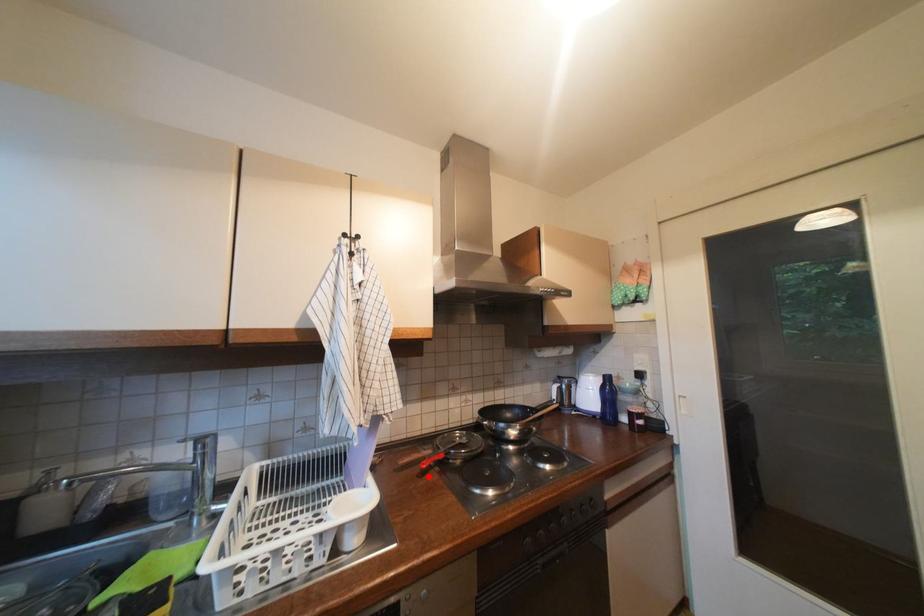
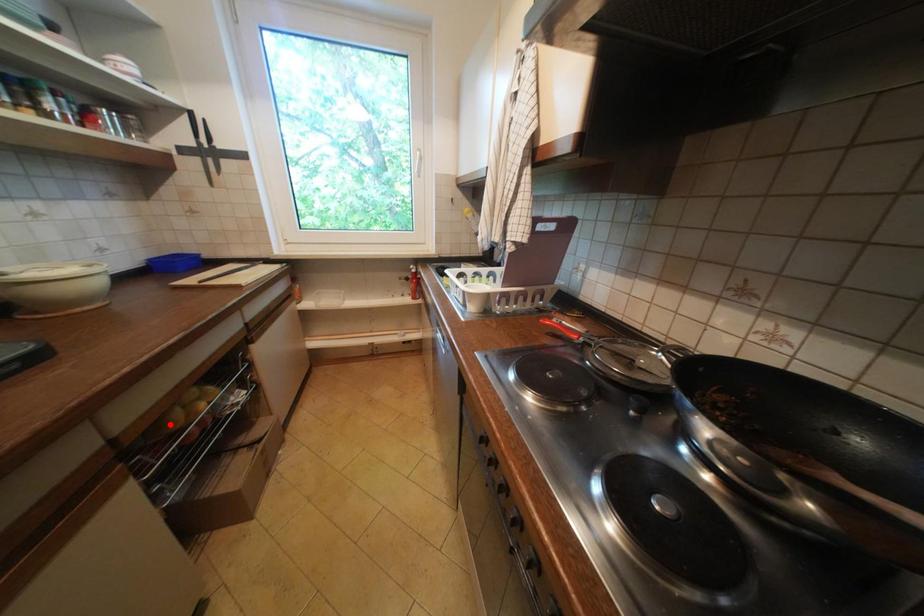
I am providing you with two images of the same scene from different viewpoints. A red point is marked on the first image and another point is marked on the second image. Are the points marked in image1 and image2 representing the same 3D position?

No